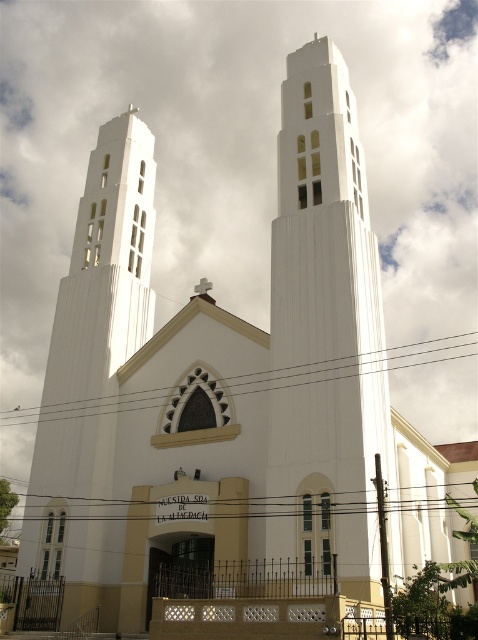
Between white smooth tower at center and white smooth tower at left, which one appears on the right side from the viewer's perspective?

white smooth tower at center

Is white smooth tower at center taller than white smooth tower at left?

Incorrect, white smooth tower at center's height is not larger of white smooth tower at left's.

Is point (359, 586) positioned in front of point (85, 538)?

Yes, it is in front of point (85, 538).

Find the location of `white smooth tower at center`. white smooth tower at center is located at coordinates (325, 326).